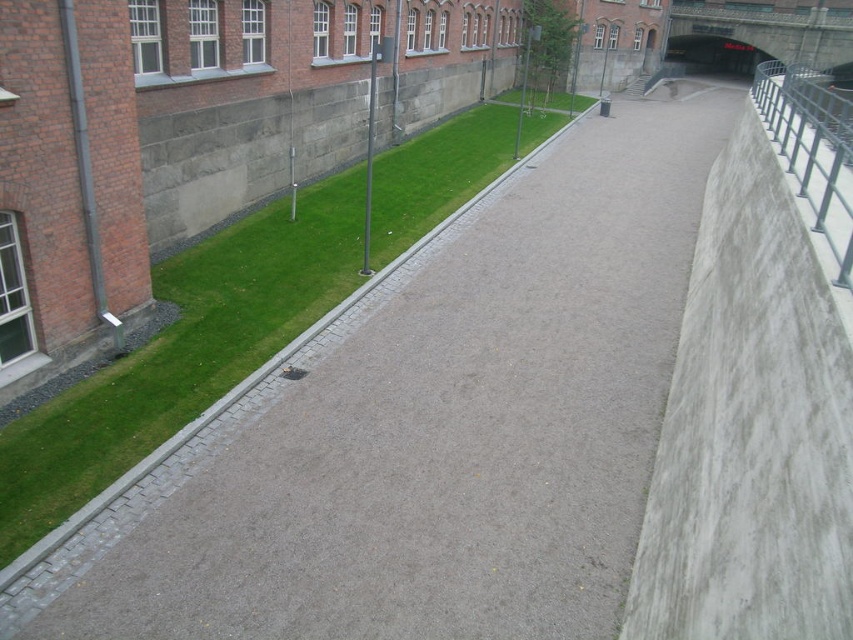
Is point (495, 132) farther from camera compared to point (289, 372)?

Yes, point (495, 132) is behind point (289, 372).

Between green grass at center and metallic gray bench at lower center, which one appears on the left side from the viewer's perspective?

Positioned to the left is green grass at center.

Does point (223, 380) lie in front of point (296, 378)?

Yes, it is in front of point (296, 378).

What are the coordinates of `green grass at center` in the screenshot? It's located at (181, 356).